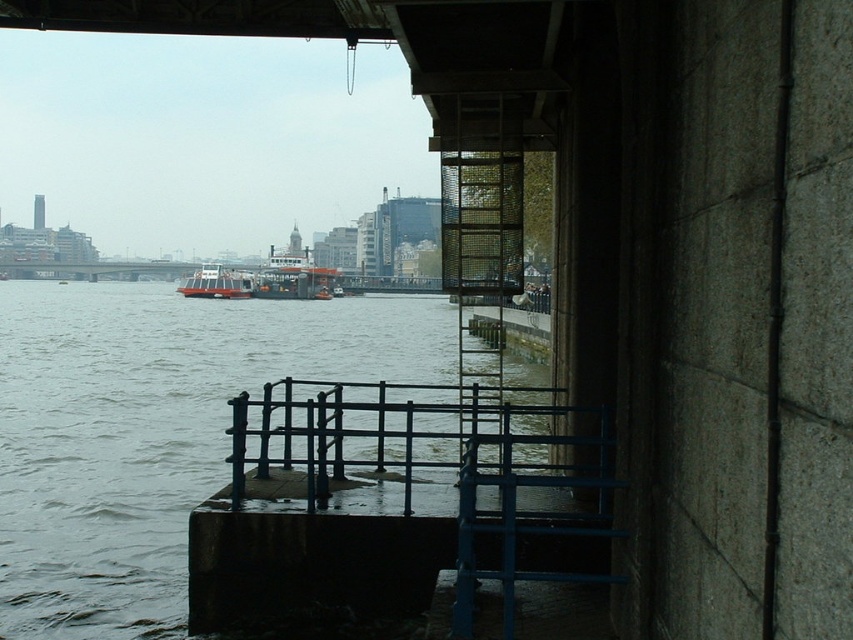
Does gray concrete water at lower left have a smaller size compared to blue metal rail at center?

No, gray concrete water at lower left is not smaller than blue metal rail at center.

Is gray concrete water at lower left above blue metal rail at center?

Yes.

This screenshot has width=853, height=640. In order to click on gray concrete water at lower left in this screenshot , I will do `click(152, 429)`.

In order to click on gray concrete water at lower left in this screenshot , I will do `click(152, 429)`.

Is blue metal rail at center further to the viewer compared to orange matte ferry at center?

No, blue metal rail at center is in front of orange matte ferry at center.

Which is behind, point (520, 406) or point (293, 289)?

The point (293, 289) is more distant.

Locate an element on the screen. blue metal rail at center is located at coordinates (392, 435).

Image resolution: width=853 pixels, height=640 pixels. What are the coordinates of `blue metal rail at center` in the screenshot? It's located at click(392, 435).

Based on the photo, does gray concrete water at lower left appear under blue metal dock at lower center?

No.

Does point (1, 428) lie behind point (456, 467)?

Yes, it is.

Identify the location of gray concrete water at lower left. (152, 429).